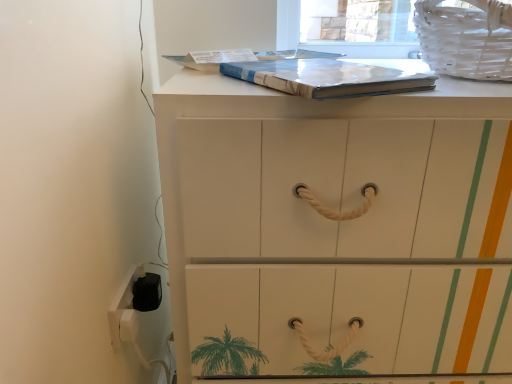
Question: Is matte blue paperback book at upper center thinner than white wicker laundry basket at upper right?

Choices:
 (A) no
 (B) yes

Answer: (B)

Question: From the image's perspective, is matte blue paperback book at upper center located beneath white wicker laundry basket at upper right?

Choices:
 (A) no
 (B) yes

Answer: (B)

Question: From a real-world perspective, is matte blue paperback book at upper center positioned over white wicker laundry basket at upper right based on gravity?

Choices:
 (A) yes
 (B) no

Answer: (B)

Question: Can you confirm if matte blue paperback book at upper center is smaller than white wicker laundry basket at upper right?

Choices:
 (A) no
 (B) yes

Answer: (B)

Question: Is matte blue paperback book at upper center at the left side of white wicker laundry basket at upper right?

Choices:
 (A) yes
 (B) no

Answer: (A)

Question: Considering their positions, is white painted wood chest of drawers at center located in front of or behind white plastic electric outlet at lower left?

Choices:
 (A) behind
 (B) front

Answer: (B)

Question: Is white painted wood chest of drawers at center situated inside white plastic electric outlet at lower left or outside?

Choices:
 (A) inside
 (B) outside

Answer: (B)

Question: Would you say white painted wood chest of drawers at center is to the left or to the right of white plastic electric outlet at lower left in the picture?

Choices:
 (A) left
 (B) right

Answer: (B)

Question: Looking at their shapes, would you say white painted wood chest of drawers at center is wider or thinner than white plastic electric outlet at lower left?

Choices:
 (A) wide
 (B) thin

Answer: (A)

Question: Is matte blue paperback book at upper center taller or shorter than white wicker laundry basket at upper right?

Choices:
 (A) tall
 (B) short

Answer: (B)

Question: In the image, is matte blue paperback book at upper center positioned in front of or behind white wicker laundry basket at upper right?

Choices:
 (A) front
 (B) behind

Answer: (A)

Question: In terms of size, does matte blue paperback book at upper center appear bigger or smaller than white wicker laundry basket at upper right?

Choices:
 (A) small
 (B) big

Answer: (A)

Question: Is matte blue paperback book at upper center wider or thinner than white wicker laundry basket at upper right?

Choices:
 (A) wide
 (B) thin

Answer: (B)

Question: In terms of height, does matte blue paperback book at upper center look taller or shorter compared to white plastic electric outlet at lower left?

Choices:
 (A) tall
 (B) short

Answer: (B)

Question: Which is correct: matte blue paperback book at upper center is inside white plastic electric outlet at lower left, or outside of it?

Choices:
 (A) outside
 (B) inside

Answer: (A)